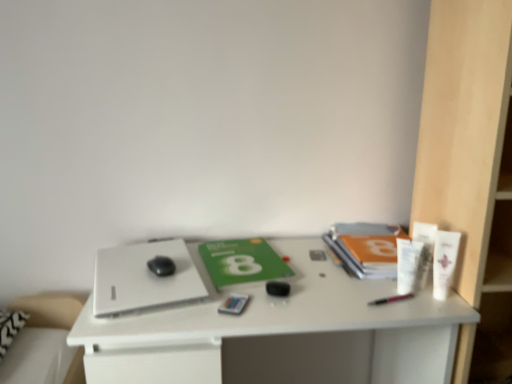
Find the location of a particular element. vacant area that lies in front of white plastic tube at right, the second toiletry in the left-to-right sequence is located at coordinates (424, 306).